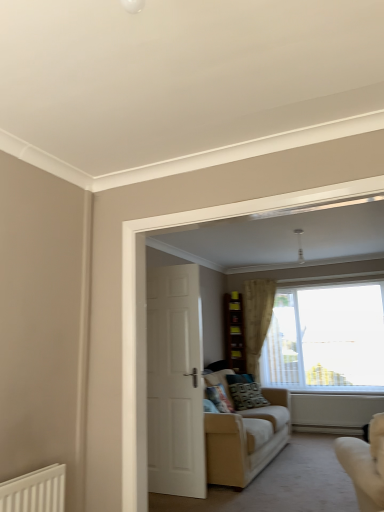
Question: Can you confirm if patterned fabric pillow at center, positioned as the 2th pillow in right-to-left order, is shorter than white glossy door at center?

Choices:
 (A) no
 (B) yes

Answer: (B)

Question: Is patterned fabric pillow at center, positioned as the 2th pillow in right-to-left order, wider than white glossy door at center?

Choices:
 (A) yes
 (B) no

Answer: (A)

Question: Is patterned fabric pillow at center, which appears as the first pillow when viewed from the left, far away from white glossy door at center?

Choices:
 (A) no
 (B) yes

Answer: (B)

Question: Is patterned fabric pillow at center, marked as the first pillow in a front-to-back arrangement, closer to camera compared to white glossy door at center?

Choices:
 (A) no
 (B) yes

Answer: (A)

Question: From the image's perspective, is patterned fabric pillow at center, which appears as the second pillow when viewed from the back, over white glossy door at center?

Choices:
 (A) no
 (B) yes

Answer: (A)

Question: From a real-world perspective, is patterned fabric pillow at center, positioned as the 2th pillow in right-to-left order, located beneath white glossy door at center?

Choices:
 (A) yes
 (B) no

Answer: (A)

Question: Are white glossy door at center and transparent glass window at center far apart?

Choices:
 (A) yes
 (B) no

Answer: (A)

Question: Is white glossy door at center facing away from transparent glass window at center?

Choices:
 (A) no
 (B) yes

Answer: (A)

Question: Is white glossy door at center positioned before transparent glass window at center?

Choices:
 (A) no
 (B) yes

Answer: (B)

Question: Is white glossy door at center smaller than transparent glass window at center?

Choices:
 (A) yes
 (B) no

Answer: (A)

Question: From a real-world perspective, is white glossy door at center positioned under transparent glass window at center based on gravity?

Choices:
 (A) no
 (B) yes

Answer: (B)

Question: Would you say transparent glass window at center is part of white glossy door at center's contents?

Choices:
 (A) yes
 (B) no

Answer: (B)

Question: Is transparent glass window at center turned away from patterned fabric pillow at center, which is the second pillow in left-to-right order?

Choices:
 (A) no
 (B) yes

Answer: (A)